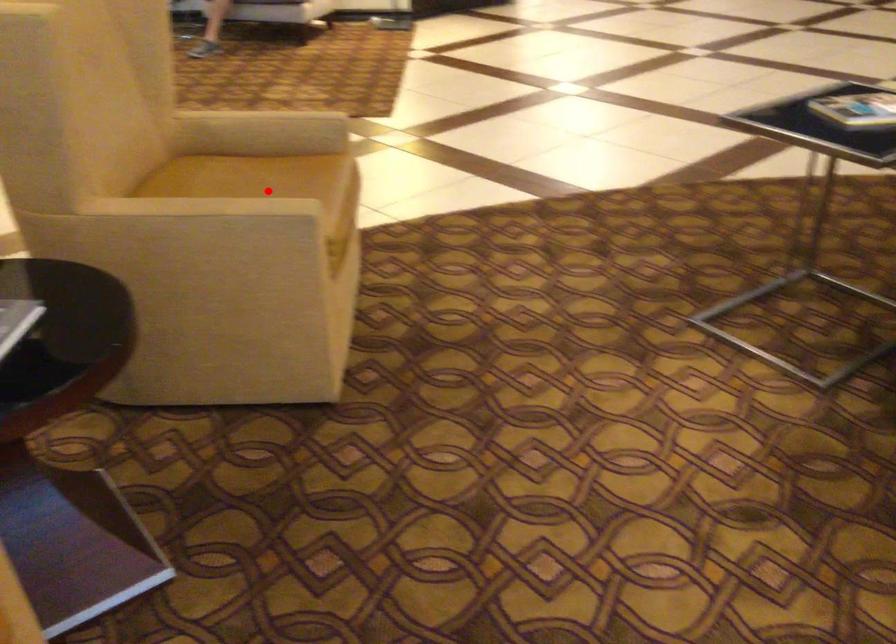
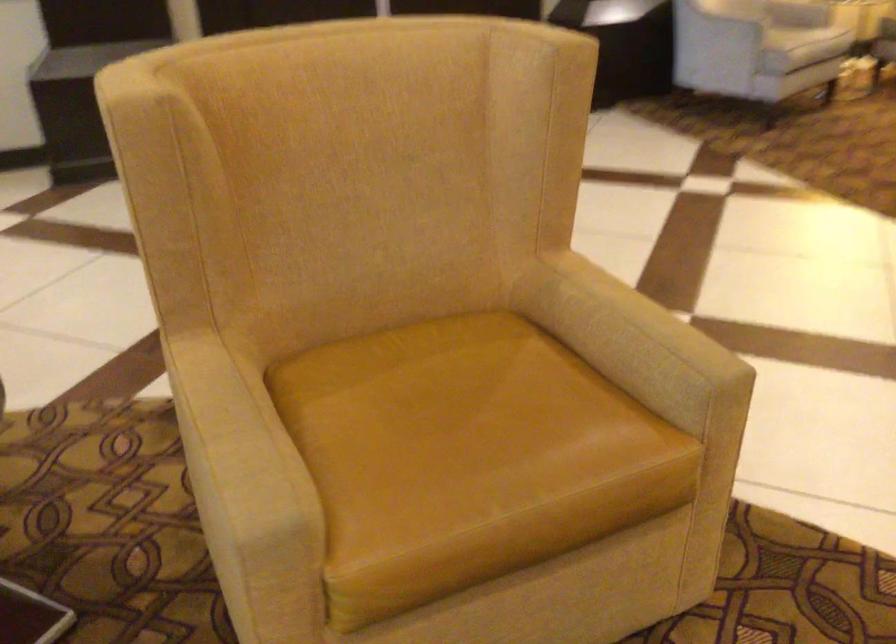
Question: I am providing you with two images of the same scene from different viewpoints. Image1 has a red point marked. In image2, the corresponding 3D location appears at what relative position? Reply with the corresponding letter.

Choices:
 (A) Closer
 (B) Farther

Answer: (A)